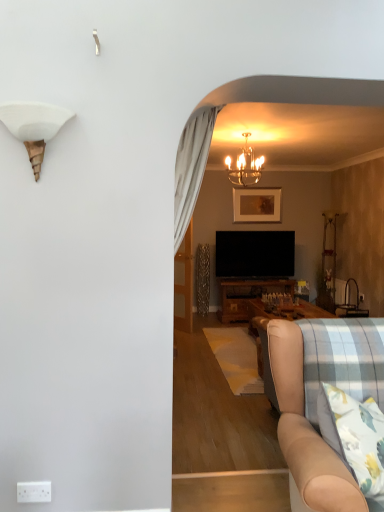
Question: Should I look upward or downward to see white matte shell at upper left, the 2th lamp in the top-to-bottom sequence?

Choices:
 (A) down
 (B) up

Answer: (B)

Question: Is beige fabric couch at lower right completely or partially inside white matte shell at upper left, acting as the first lamp starting from the left?

Choices:
 (A) yes
 (B) no

Answer: (B)

Question: From the image's perspective, is white matte shell at upper left, positioned as the second lamp in right-to-left order, under beige fabric couch at lower right?

Choices:
 (A) yes
 (B) no

Answer: (B)

Question: Is white matte shell at upper left, the 1th lamp from the front, thinner than beige fabric couch at lower right?

Choices:
 (A) no
 (B) yes

Answer: (B)

Question: Is white matte shell at upper left, the 1th lamp in the bottom-to-top sequence, positioned with its back to beige fabric couch at lower right?

Choices:
 (A) no
 (B) yes

Answer: (A)

Question: From a real-world perspective, does white matte shell at upper left, the 1th lamp in the bottom-to-top sequence, sit lower than beige fabric couch at lower right?

Choices:
 (A) yes
 (B) no

Answer: (B)

Question: Are white matte shell at upper left, acting as the first lamp starting from the left, and beige fabric couch at lower right far apart?

Choices:
 (A) yes
 (B) no

Answer: (A)

Question: Is white plastic power outlet at lower left at the back of transparent glass door at center?

Choices:
 (A) no
 (B) yes

Answer: (A)

Question: Is transparent glass door at center not within white plastic power outlet at lower left?

Choices:
 (A) yes
 (B) no

Answer: (A)

Question: Can you confirm if transparent glass door at center is thinner than white plastic power outlet at lower left?

Choices:
 (A) yes
 (B) no

Answer: (B)

Question: Considering the relative sizes of transparent glass door at center and white plastic power outlet at lower left in the image provided, is transparent glass door at center shorter than white plastic power outlet at lower left?

Choices:
 (A) yes
 (B) no

Answer: (B)

Question: Does transparent glass door at center have a greater width compared to white plastic power outlet at lower left?

Choices:
 (A) no
 (B) yes

Answer: (B)

Question: Is transparent glass door at center positioned before white plastic power outlet at lower left?

Choices:
 (A) no
 (B) yes

Answer: (A)

Question: Is white plastic power outlet at lower left far away from beige fabric couch at lower right?

Choices:
 (A) yes
 (B) no

Answer: (A)